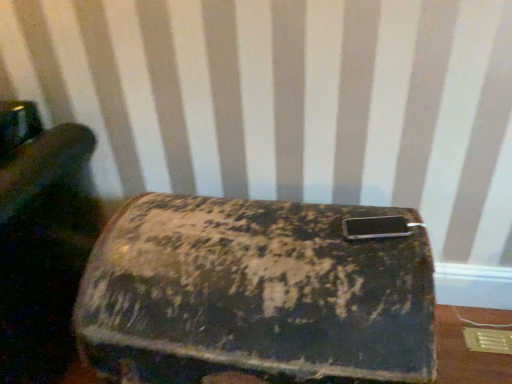
What do you see at coordinates (258, 293) in the screenshot?
I see `rusty metal suitcase at center` at bounding box center [258, 293].

Measure the distance between rusty metal suitcase at center and camera.

rusty metal suitcase at center is 30.04 inches away from camera.

Identify the location of rusty metal suitcase at center. (258, 293).

At what (x,y) coordinates should I click in order to perform the action: click on rusty metal suitcase at center. Please return your answer as a coordinate pair (x, y). The image size is (512, 384). Looking at the image, I should click on (258, 293).